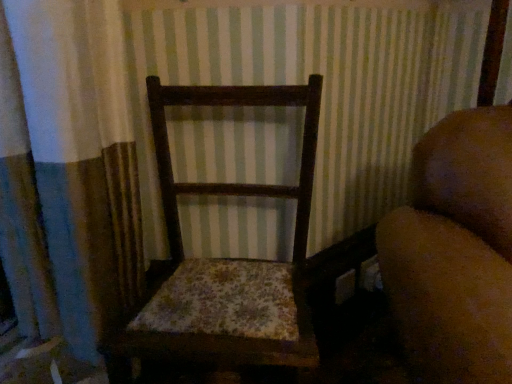
Question: From the image's perspective, relative to brown fuzzy couch at right, is wooden floral cushioned chair at center above or below?

Choices:
 (A) below
 (B) above

Answer: (B)

Question: Considering the positions of wooden floral cushioned chair at center and brown fuzzy couch at right in the image, is wooden floral cushioned chair at center wider or thinner than brown fuzzy couch at right?

Choices:
 (A) wide
 (B) thin

Answer: (B)

Question: From a real-world perspective, is wooden floral cushioned chair at center positioned above or below brown fuzzy couch at right?

Choices:
 (A) below
 (B) above

Answer: (A)

Question: Is brown fuzzy couch at right to the left or to the right of wooden floral cushioned chair at center in the image?

Choices:
 (A) right
 (B) left

Answer: (A)

Question: Considering the positions of brown fuzzy couch at right and wooden floral cushioned chair at center in the image, is brown fuzzy couch at right bigger or smaller than wooden floral cushioned chair at center?

Choices:
 (A) big
 (B) small

Answer: (A)

Question: Is brown fuzzy couch at right spatially inside wooden floral cushioned chair at center, or outside of it?

Choices:
 (A) outside
 (B) inside

Answer: (A)

Question: Looking at their shapes, would you say brown fuzzy couch at right is wider or thinner than wooden floral cushioned chair at center?

Choices:
 (A) wide
 (B) thin

Answer: (A)